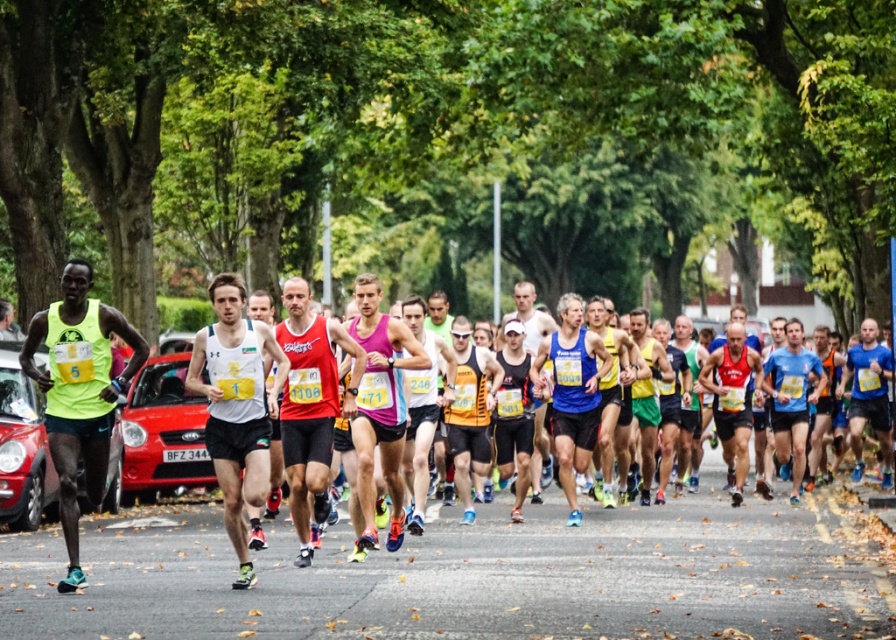
Is the position of neon yellow fabric at left more distant than that of black mesh tank top at center?

No, neon yellow fabric at left is closer to the viewer.

How much distance is there between neon yellow fabric at left and black mesh tank top at center?

A distance of 7.59 meters exists between neon yellow fabric at left and black mesh tank top at center.

Is point (65, 504) positioned after point (507, 465)?

No, (65, 504) is closer to viewer.

What are the coordinates of `neon yellow fabric at left` in the screenshot? It's located at (79, 392).

Is neon yellow fabric at left below pink fabric tank top at center?

No, neon yellow fabric at left is not below pink fabric tank top at center.

Can you confirm if neon yellow fabric at left is wider than pink fabric tank top at center?

Yes.

You are a GUI agent. You are given a task and a screenshot of the screen. Output one action in this format:
    pyautogui.click(x=<x>, y=<y>)
    Task: Click on the neon yellow fabric at left
    This screenshot has width=896, height=640.
    Given the screenshot: What is the action you would take?
    pyautogui.click(x=79, y=392)

Is point (421, 301) positioned in front of point (881, 369)?

Yes, it is in front of point (881, 369).

Looking at this image, can you confirm if pink fabric tank top at center is taller than blue fabric shorts at center?

No, pink fabric tank top at center is not taller than blue fabric shorts at center.

At what (x,y) coordinates should I click in order to perform the action: click on pink fabric tank top at center. Please return your answer as a coordinate pair (x, y). Image resolution: width=896 pixels, height=640 pixels. Looking at the image, I should click on (421, 408).